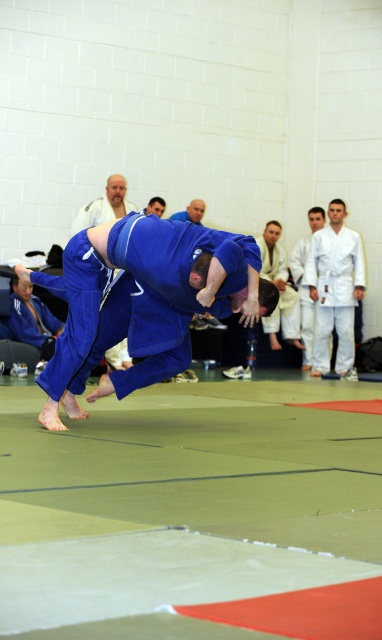
Question: Can you confirm if blue fabric judo at center is thinner than white karate uniform at upper right?

Choices:
 (A) no
 (B) yes

Answer: (A)

Question: Can you confirm if blue fabric judo at center is positioned below blue fabric uniform at center?

Choices:
 (A) yes
 (B) no

Answer: (A)

Question: Estimate the real-world distances between objects in this image. Which object is closer to the white/textured kimono at center?

Choices:
 (A) blue fabric judo at center
 (B) white karate uniform at upper center
 (C) white karate uniform at upper right

Answer: (C)

Question: Which object is positioned closest to the white karate uniform at upper right?

Choices:
 (A) blue fabric kimono at lower left
 (B) white/textured kimono at center

Answer: (B)

Question: Is blue fabric judo at center bigger than white karate uniform at upper right?

Choices:
 (A) no
 (B) yes

Answer: (B)

Question: Which point appears farthest from the camera in this image?

Choices:
 (A) (184, 358)
 (B) (312, 211)

Answer: (B)